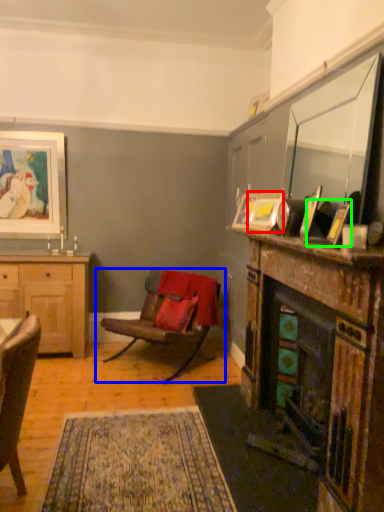
Question: Considering the real-world distances, which object is closest to picture frame (highlighted by a red box)? chair (highlighted by a blue box) or picture frame (highlighted by a green box).

Choices:
 (A) chair
 (B) picture frame

Answer: (B)